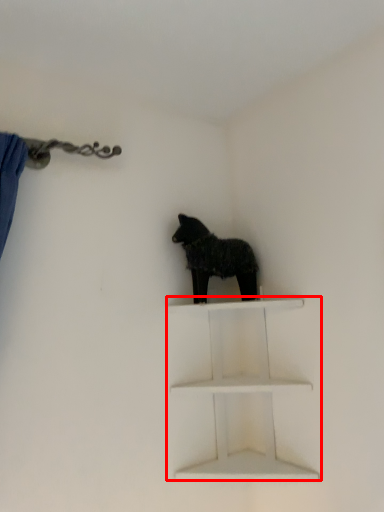
Question: From the image's perspective, what is the correct spatial relationship of shelf (annotated by the red box) in relation to dog?

Choices:
 (A) above
 (B) below

Answer: (B)